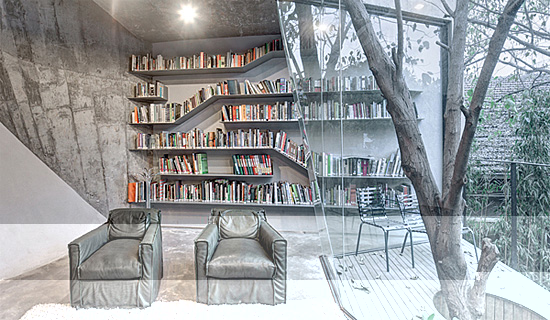
The image size is (550, 320). Identify the location of light. (182, 18).